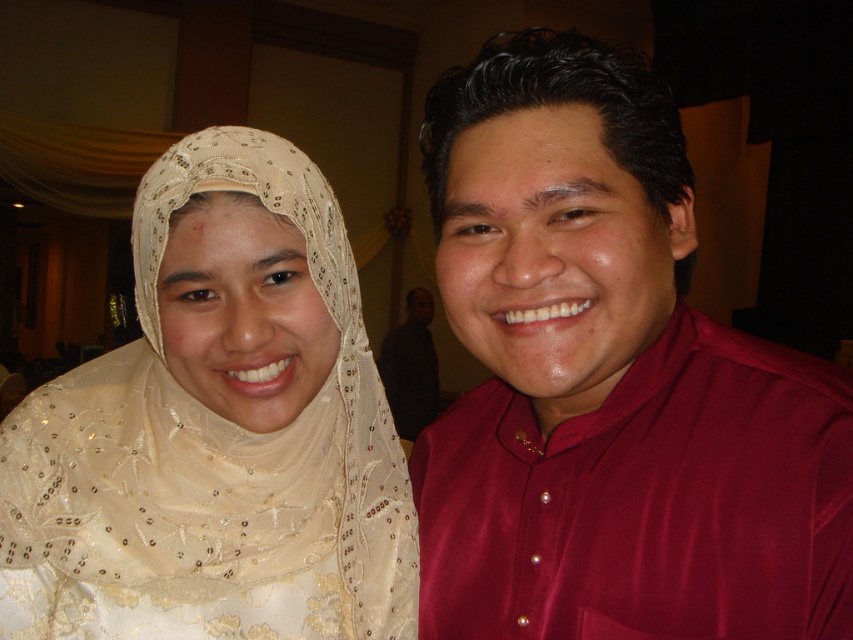
Question: Which point is farther to the camera?

Choices:
 (A) matte beige veil at upper left
 (B) dark brown shirt at center
 (C) maroon satin shirt at right

Answer: (B)

Question: Does maroon satin shirt at right appear under dark brown shirt at center?

Choices:
 (A) yes
 (B) no

Answer: (B)

Question: Which point appears farthest from the camera in this image?

Choices:
 (A) (146, 604)
 (B) (415, 396)

Answer: (B)

Question: Estimate the real-world distances between objects in this image. Which object is farther from the matte beige veil at upper left?

Choices:
 (A) maroon satin shirt at right
 (B) dark brown shirt at center

Answer: (B)

Question: Does maroon satin shirt at right come in front of matte beige veil at upper left?

Choices:
 (A) no
 (B) yes

Answer: (B)

Question: Observing the image, what is the correct spatial positioning of maroon satin shirt at right in reference to dark brown shirt at center?

Choices:
 (A) left
 (B) right

Answer: (B)